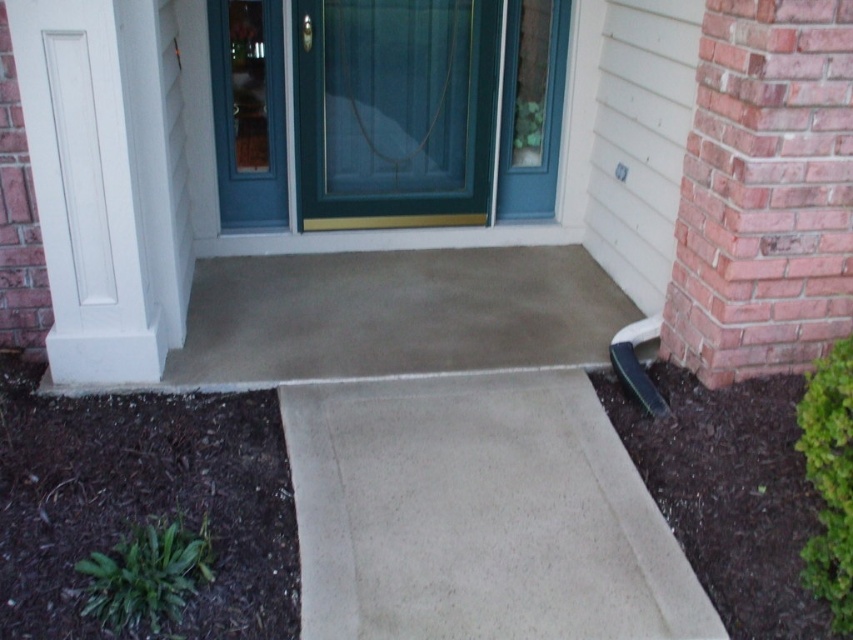
Can you confirm if beige concrete ramp at lower center is taller than dark brown mulch at lower right?

In fact, beige concrete ramp at lower center may be shorter than dark brown mulch at lower right.

Between beige concrete ramp at lower center and dark brown mulch at lower right, which one has more height?

Standing taller between the two is dark brown mulch at lower right.

The image size is (853, 640). Find the location of `beige concrete ramp at lower center`. beige concrete ramp at lower center is located at coordinates (479, 515).

Which of these two, white smooth column at left or dark brown mulch at lower right, stands shorter?

With less height is dark brown mulch at lower right.

Does point (55, 353) lie in front of point (630, 438)?

No, (55, 353) is further to viewer.

Find the location of a particular element. The width and height of the screenshot is (853, 640). white smooth column at left is located at coordinates (86, 189).

Is dark brown mulch at lower left positioned at the back of dark brown mulch at lower right?

No, it is not.

Which is in front, point (283, 563) or point (798, 509)?

Positioned in front is point (283, 563).

This screenshot has height=640, width=853. What do you see at coordinates (143, 504) in the screenshot? I see `dark brown mulch at lower left` at bounding box center [143, 504].

Where is `dark brown mulch at lower left`? This screenshot has width=853, height=640. dark brown mulch at lower left is located at coordinates (143, 504).